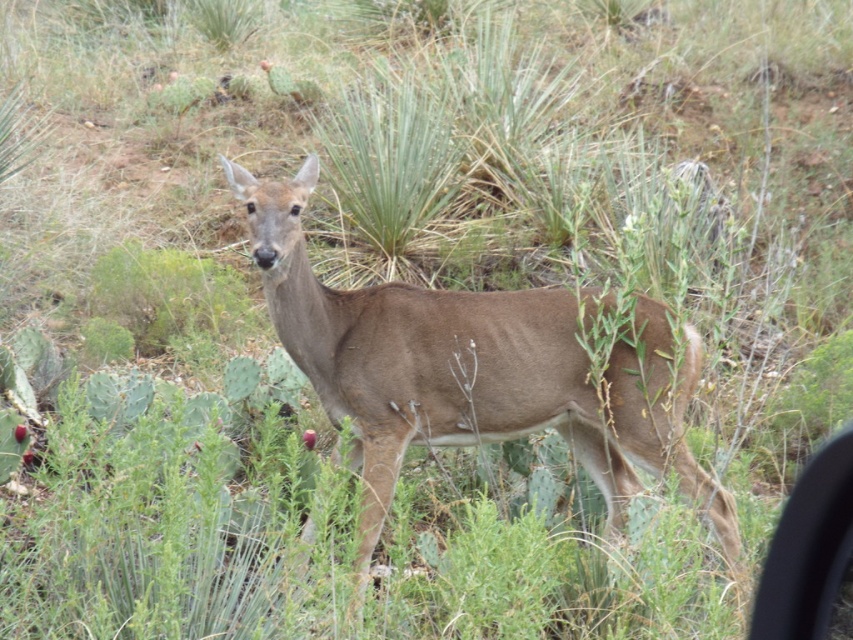
Question: Which point appears farthest from the camera in this image?

Choices:
 (A) (546, 376)
 (B) (779, 595)

Answer: (A)

Question: Is brown matte/deer at center wider than transparent plastic car window at lower right?

Choices:
 (A) yes
 (B) no

Answer: (A)

Question: Is brown matte/deer at center thinner than transparent plastic car window at lower right?

Choices:
 (A) no
 (B) yes

Answer: (A)

Question: Observing the image, what is the correct spatial positioning of brown matte/deer at center in reference to transparent plastic car window at lower right?

Choices:
 (A) above
 (B) below

Answer: (A)

Question: Which of the following is the farthest from the observer?

Choices:
 (A) (756, 616)
 (B) (685, 468)

Answer: (B)